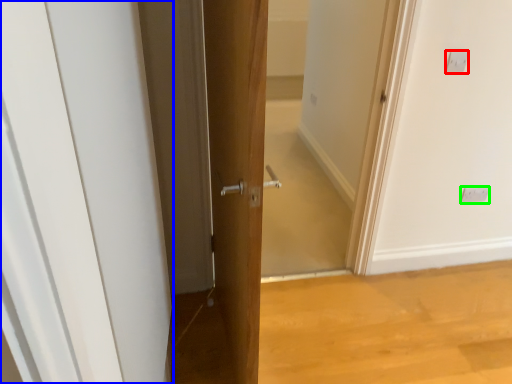
Question: Estimate the real-world distances between objects in this image. Which object is farther from electric outlet (highlighted by a red box), door (highlighted by a blue box) or electric outlet (highlighted by a green box)?

Choices:
 (A) door
 (B) electric outlet

Answer: (A)